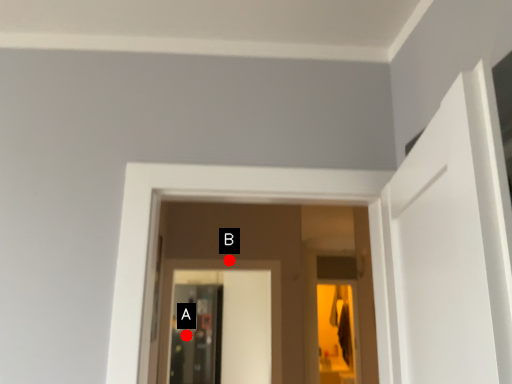
Question: Two points are circled on the image, labeled by A and B beside each circle. Which of the following is the farthest from the observer?

Choices:
 (A) A is further
 (B) B is further

Answer: (A)